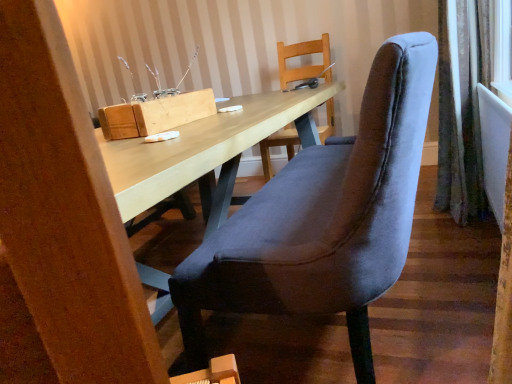
Question: Considering the relative sizes of velvet curtain at right and wooden block at upper center in the image provided, is velvet curtain at right wider than wooden block at upper center?

Choices:
 (A) yes
 (B) no

Answer: (A)

Question: Is velvet curtain at right further to camera compared to wooden block at upper center?

Choices:
 (A) no
 (B) yes

Answer: (B)

Question: Can you confirm if velvet curtain at right is positioned to the left of wooden block at upper center?

Choices:
 (A) no
 (B) yes

Answer: (A)

Question: Is velvet curtain at right far from wooden block at upper center?

Choices:
 (A) no
 (B) yes

Answer: (B)

Question: Can wooden block at upper center be found inside velvet curtain at right?

Choices:
 (A) no
 (B) yes

Answer: (A)

Question: Is velvet curtain at right oriented away from wooden block at upper center?

Choices:
 (A) yes
 (B) no

Answer: (B)

Question: Is velvet curtain at right oriented towards velvet blue chair at center?

Choices:
 (A) yes
 (B) no

Answer: (B)

Question: Is velvet curtain at right looking in the opposite direction of velvet blue chair at center?

Choices:
 (A) yes
 (B) no

Answer: (B)

Question: Is velvet blue chair at center surrounded by velvet curtain at right?

Choices:
 (A) no
 (B) yes

Answer: (A)

Question: From the image's perspective, would you say velvet curtain at right is positioned over velvet blue chair at center?

Choices:
 (A) no
 (B) yes

Answer: (B)

Question: Can you confirm if velvet curtain at right is positioned to the right of velvet blue chair at center?

Choices:
 (A) no
 (B) yes

Answer: (B)

Question: Is velvet curtain at right positioned far away from velvet blue chair at center?

Choices:
 (A) no
 (B) yes

Answer: (B)

Question: Is wooden block at upper center to the left of velvet curtain at right from the viewer's perspective?

Choices:
 (A) no
 (B) yes

Answer: (B)